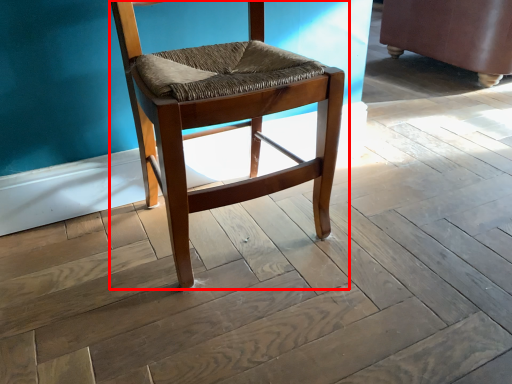
Question: Where is chair (annotated by the red box) located in relation to swivel chair in the image?

Choices:
 (A) left
 (B) right

Answer: (A)